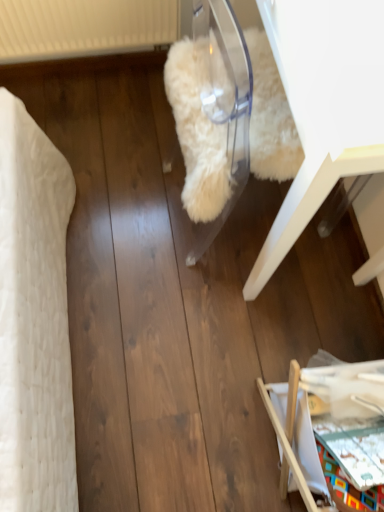
Question: Should I look upward or downward to see white fluffy rug at center, acting as the first furniture starting from the top?

Choices:
 (A) up
 (B) down

Answer: (A)

Question: Considering the relative sizes of wooden folding chair at lower right, marked as the first furniture in a bottom-to-top arrangement, and white fluffy rug at center, acting as the first furniture starting from the top, in the image provided, is wooden folding chair at lower right, marked as the first furniture in a bottom-to-top arrangement, bigger than white fluffy rug at center, acting as the first furniture starting from the top,?

Choices:
 (A) no
 (B) yes

Answer: (A)

Question: Considering the relative sizes of wooden folding chair at lower right, marked as the first furniture in a bottom-to-top arrangement, and white fluffy rug at center, placed as the second furniture when sorted from bottom to top, in the image provided, is wooden folding chair at lower right, marked as the first furniture in a bottom-to-top arrangement, thinner than white fluffy rug at center, placed as the second furniture when sorted from bottom to top,?

Choices:
 (A) yes
 (B) no

Answer: (B)

Question: Is wooden folding chair at lower right, which appears as the second furniture when viewed from the top, at the left side of white fluffy rug at center, placed as the second furniture when sorted from bottom to top?

Choices:
 (A) yes
 (B) no

Answer: (B)

Question: Is wooden folding chair at lower right, which appears as the second furniture when viewed from the top, facing away from white fluffy rug at center, acting as the first furniture starting from the top?

Choices:
 (A) no
 (B) yes

Answer: (A)

Question: Does wooden folding chair at lower right, marked as the first furniture in a bottom-to-top arrangement, have a greater width compared to white fluffy rug at center, placed as the second furniture when sorted from bottom to top?

Choices:
 (A) no
 (B) yes

Answer: (B)

Question: Can you confirm if wooden folding chair at lower right, which appears as the second furniture when viewed from the top, is taller than white fluffy rug at center, acting as the first furniture starting from the top?

Choices:
 (A) yes
 (B) no

Answer: (B)

Question: Is white fluffy rug at center, placed as the second furniture when sorted from bottom to top, shorter than wooden folding chair at lower right, which appears as the second furniture when viewed from the top?

Choices:
 (A) yes
 (B) no

Answer: (B)

Question: Is white fluffy rug at center, acting as the first furniture starting from the top, to the right of wooden folding chair at lower right, marked as the first furniture in a bottom-to-top arrangement, from the viewer's perspective?

Choices:
 (A) yes
 (B) no

Answer: (B)

Question: Does white fluffy rug at center, acting as the first furniture starting from the top, have a smaller size compared to wooden folding chair at lower right, marked as the first furniture in a bottom-to-top arrangement?

Choices:
 (A) yes
 (B) no

Answer: (B)

Question: From the image's perspective, would you say white fluffy rug at center, acting as the first furniture starting from the top, is positioned over wooden folding chair at lower right, marked as the first furniture in a bottom-to-top arrangement?

Choices:
 (A) yes
 (B) no

Answer: (A)

Question: Does white fluffy rug at center, acting as the first furniture starting from the top, appear on the left side of wooden folding chair at lower right, which appears as the second furniture when viewed from the top?

Choices:
 (A) yes
 (B) no

Answer: (A)

Question: Are white fluffy rug at center, acting as the first furniture starting from the top, and wooden folding chair at lower right, marked as the first furniture in a bottom-to-top arrangement, far apart?

Choices:
 (A) no
 (B) yes

Answer: (A)

Question: Considering the positions of white fluffy rug at center, placed as the second furniture when sorted from bottom to top, and wooden folding chair at lower right, which appears as the second furniture when viewed from the top, in the image, is white fluffy rug at center, placed as the second furniture when sorted from bottom to top, bigger or smaller than wooden folding chair at lower right, which appears as the second furniture when viewed from the top,?

Choices:
 (A) big
 (B) small

Answer: (A)